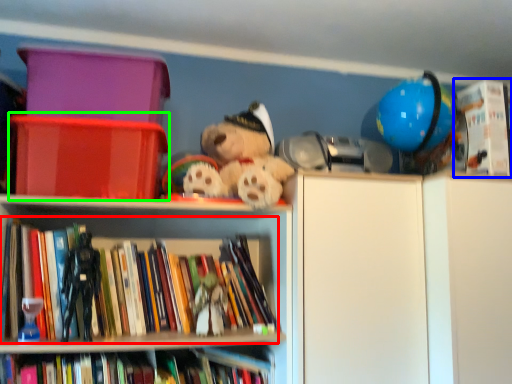
Question: Estimate the real-world distances between objects in this image. Which object is farther from book (highlighted by a red box), book (highlighted by a blue box) or storage box (highlighted by a green box)?

Choices:
 (A) book
 (B) storage box

Answer: (A)